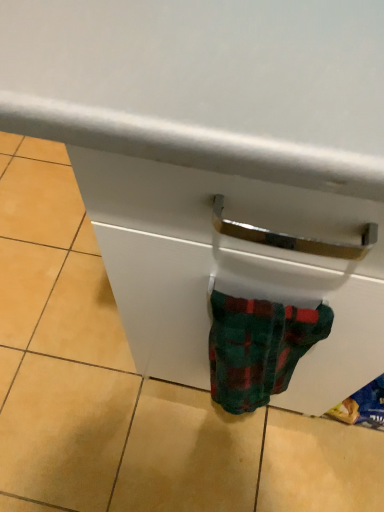
Where is `fluffy plaid sock at lower right`? fluffy plaid sock at lower right is located at coordinates (258, 348).

This screenshot has width=384, height=512. Describe the element at coordinates (258, 348) in the screenshot. I see `fluffy plaid sock at lower right` at that location.

The image size is (384, 512). Describe the element at coordinates (231, 269) in the screenshot. I see `white glossy drawer at center` at that location.

You are a GUI agent. You are given a task and a screenshot of the screen. Output one action in this format:
    pyautogui.click(x=<x>, y=<y>)
    Task: Click on the white glossy drawer at center
    
    Given the screenshot: What is the action you would take?
    pyautogui.click(x=231, y=269)

Find the location of a particular element. Image resolution: width=384 pixels, height=512 pixels. fluffy plaid sock at lower right is located at coordinates (258, 348).

Considering the positions of objects fluffy plaid sock at lower right and white glossy drawer at center in the image provided, who is more to the left, fluffy plaid sock at lower right or white glossy drawer at center?

Positioned to the left is white glossy drawer at center.

Considering the relative positions of fluffy plaid sock at lower right and white glossy drawer at center in the image provided, is fluffy plaid sock at lower right behind white glossy drawer at center?

No, fluffy plaid sock at lower right is closer to the camera.

Considering the positions of point (256, 381) and point (278, 213), is point (256, 381) closer or farther from the camera than point (278, 213)?

Point (256, 381).

From the image's perspective, which object appears higher, fluffy plaid sock at lower right or white glossy drawer at center?

From the image's view, white glossy drawer at center is above.

From a real-world perspective, which is physically above, fluffy plaid sock at lower right or white glossy drawer at center?

fluffy plaid sock at lower right is physically above.

Does fluffy plaid sock at lower right have a greater width compared to white glossy drawer at center?

Incorrect, the width of fluffy plaid sock at lower right does not surpass that of white glossy drawer at center.

Considering the relative sizes of fluffy plaid sock at lower right and white glossy drawer at center in the image provided, is fluffy plaid sock at lower right taller than white glossy drawer at center?

Yes.

Based on the photo, can you confirm if fluffy plaid sock at lower right is smaller than white glossy drawer at center?

Yes.

Is fluffy plaid sock at lower right located outside white glossy drawer at center?

That's correct, fluffy plaid sock at lower right is outside of white glossy drawer at center.

Is fluffy plaid sock at lower right beside white glossy drawer at center?

Yes, fluffy plaid sock at lower right is touching white glossy drawer at center.

Is fluffy plaid sock at lower right looking in the opposite direction of white glossy drawer at center?

No, fluffy plaid sock at lower right is not facing away from white glossy drawer at center.

Can you tell me how much fluffy plaid sock at lower right and white glossy drawer at center differ in facing direction?

The facing directions of fluffy plaid sock at lower right and white glossy drawer at center are 177 degrees apart.

Locate an element on the screen. The image size is (384, 512). drawer below the fluffy plaid sock at lower right (from a real-world perspective) is located at coordinates (231, 269).

Considering the positions of objects white glossy drawer at center and fluffy plaid sock at lower right in the image provided, who is more to the left, white glossy drawer at center or fluffy plaid sock at lower right?

From the viewer's perspective, white glossy drawer at center appears more on the left side.

Based on the photo, considering the positions of objects white glossy drawer at center and fluffy plaid sock at lower right in the image provided, who is behind, white glossy drawer at center or fluffy plaid sock at lower right?

white glossy drawer at center is further from the camera.

Considering the points (360, 345) and (282, 376), which point is in front, point (360, 345) or point (282, 376)?

Positioned in front is point (360, 345).

From the image's perspective, is white glossy drawer at center below fluffy plaid sock at lower right?

No, from the image's perspective, white glossy drawer at center is not below fluffy plaid sock at lower right.

Based on the photo, from a real-world perspective, which is physically above, white glossy drawer at center or fluffy plaid sock at lower right?

In real-world perspective, fluffy plaid sock at lower right is above.

Does white glossy drawer at center have a lesser width compared to fluffy plaid sock at lower right?

No, white glossy drawer at center is not thinner than fluffy plaid sock at lower right.

Between white glossy drawer at center and fluffy plaid sock at lower right, which one has less height?

Standing shorter between the two is white glossy drawer at center.

Which of these two, white glossy drawer at center or fluffy plaid sock at lower right, is bigger?

With larger size is white glossy drawer at center.

Can we say white glossy drawer at center lies outside fluffy plaid sock at lower right?

Absolutely, white glossy drawer at center is external to fluffy plaid sock at lower right.

Are white glossy drawer at center and fluffy plaid sock at lower right located far from each other?

No, white glossy drawer at center is in close proximity to fluffy plaid sock at lower right.

Is white glossy drawer at center aimed at fluffy plaid sock at lower right?

No, white glossy drawer at center is not facing towards fluffy plaid sock at lower right.

Can you tell me how much white glossy drawer at center and fluffy plaid sock at lower right differ in facing direction?

There is a 177-degree angle between the facing directions of white glossy drawer at center and fluffy plaid sock at lower right.

How distant is white glossy drawer at center from fluffy plaid sock at lower right?

white glossy drawer at center is 3.21 inches from fluffy plaid sock at lower right.

Find the location of a particular element. The image size is (384, 512). drawer located behind the fluffy plaid sock at lower right is located at coordinates (231, 269).

Where is `drawer below the fluffy plaid sock at lower right (from a real-world perspective)`? This screenshot has width=384, height=512. drawer below the fluffy plaid sock at lower right (from a real-world perspective) is located at coordinates (231, 269).

Identify the location of sock to the right of white glossy drawer at center. (258, 348).